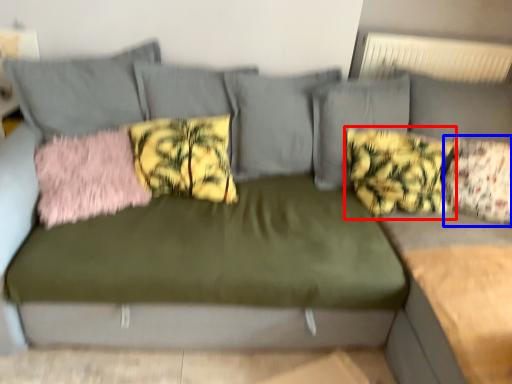
Question: Among these objects, which one is farthest to the camera, pillow (highlighted by a red box) or pillow (highlighted by a blue box)?

Choices:
 (A) pillow
 (B) pillow

Answer: (A)